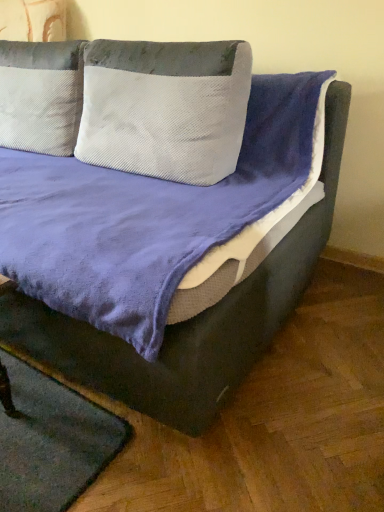
The height and width of the screenshot is (512, 384). In order to click on vacant point above green felt mat at lower left (from a real-world perspective) in this screenshot , I will do `click(43, 431)`.